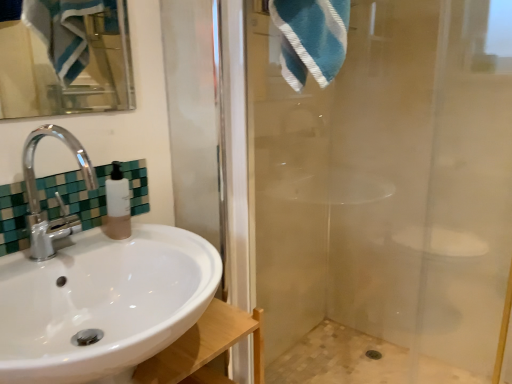
Question: Considering the positions of beige mosaic tile bath at lower right and white glossy sink at lower left in the image, is beige mosaic tile bath at lower right bigger or smaller than white glossy sink at lower left?

Choices:
 (A) big
 (B) small

Answer: (B)

Question: Do you think beige mosaic tile bath at lower right is within white glossy sink at lower left, or outside of it?

Choices:
 (A) outside
 (B) inside

Answer: (A)

Question: Estimate the real-world distances between objects in this image. Which object is farther from the white glossy sink at lower left?

Choices:
 (A) beige mosaic tile bath at lower right
 (B) green mosaic tile at upper left
 (C) blue striped towel at upper right
 (D) translucent plastic soap dispenser at sink
 (E) transparent glass shower door at right

Answer: (A)

Question: Which object is the farthest from the blue striped towel at upper right?

Choices:
 (A) transparent glass shower door at right
 (B) white glossy sink at lower left
 (C) translucent plastic soap dispenser at sink
 (D) green mosaic tile at upper left
 (E) beige mosaic tile bath at lower right

Answer: (E)